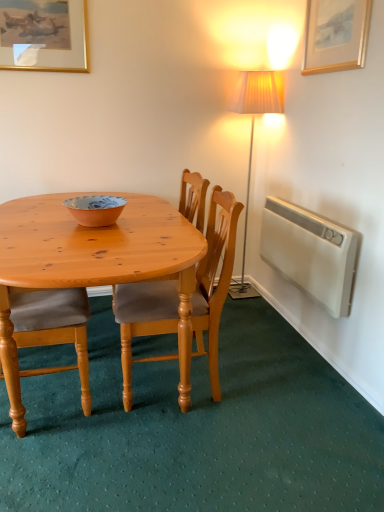
Question: Is gold-framed picture at upper left, positioned as the 1th picture frame in back-to-front order, outside white plastic radiator at right?

Choices:
 (A) yes
 (B) no

Answer: (A)

Question: From the image's perspective, is gold-framed picture at upper left, the 2th picture frame when ordered from right to left, above white plastic radiator at right?

Choices:
 (A) no
 (B) yes

Answer: (B)

Question: From a real-world perspective, is gold-framed picture at upper left, the second picture frame when ordered from front to back, positioned over white plastic radiator at right based on gravity?

Choices:
 (A) no
 (B) yes

Answer: (B)

Question: From a real-world perspective, is gold-framed picture at upper left, placed as the 1th picture frame when sorted from left to right, beneath white plastic radiator at right?

Choices:
 (A) no
 (B) yes

Answer: (A)

Question: Does gold-framed picture at upper left, placed as the 1th picture frame when sorted from left to right, have a greater height compared to white plastic radiator at right?

Choices:
 (A) yes
 (B) no

Answer: (B)

Question: From the image's perspective, is light brown wood chair at center, the 2th chair positioned from the left, located above or below white plastic radiator at right?

Choices:
 (A) below
 (B) above

Answer: (A)

Question: From a real-world perspective, is light brown wood chair at center, the 2th chair positioned from the left, above or below white plastic radiator at right?

Choices:
 (A) above
 (B) below

Answer: (B)

Question: Is light brown wood chair at center, the 2th chair positioned from the left, situated inside white plastic radiator at right or outside?

Choices:
 (A) outside
 (B) inside

Answer: (A)

Question: From their relative heights in the image, would you say light brown wood chair at center, the first chair in the right-to-left sequence, is taller or shorter than white plastic radiator at right?

Choices:
 (A) short
 (B) tall

Answer: (B)

Question: Is point (344, 22) positioned closer to the camera than point (261, 220)?

Choices:
 (A) farther
 (B) closer

Answer: (B)

Question: From the image's perspective, is wooden picture frame at upper right, marked as the second picture frame in a left-to-right arrangement, located above or below white plastic radiator at right?

Choices:
 (A) below
 (B) above

Answer: (B)

Question: Relative to white plastic radiator at right, is wooden picture frame at upper right, which is the 2th picture frame from back to front, in front or behind?

Choices:
 (A) behind
 (B) front

Answer: (B)

Question: Considering the positions of wooden picture frame at upper right, marked as the first picture frame in a right-to-left arrangement, and white plastic radiator at right in the image, is wooden picture frame at upper right, marked as the first picture frame in a right-to-left arrangement, bigger or smaller than white plastic radiator at right?

Choices:
 (A) small
 (B) big

Answer: (A)

Question: Is wooden chair at left, the 1th chair positioned from the left, taller or shorter than light brown wood chair at center, the first chair in the right-to-left sequence?

Choices:
 (A) short
 (B) tall

Answer: (B)

Question: Considering their positions, is wooden chair at left, which is the second chair in right-to-left order, located in front of or behind light brown wood chair at center, the first chair in the right-to-left sequence?

Choices:
 (A) behind
 (B) front

Answer: (B)